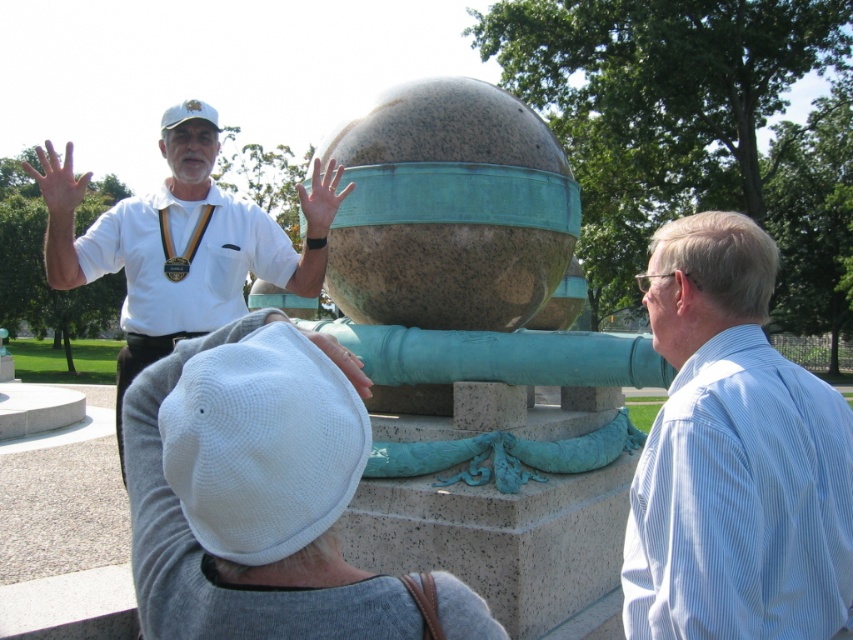
Question: Is granite sphere at center to the right of dry skin at center from the viewer's perspective?

Choices:
 (A) no
 (B) yes

Answer: (B)

Question: Which point appears closest to the camera in this image?

Choices:
 (A) (352, 356)
 (B) (810, 465)
 (C) (544, 125)

Answer: (A)

Question: Which of the following is the closest to the observer?

Choices:
 (A) matte white hand at center
 (B) dry skin at center
 (C) blue striped shirt at right
 (D) white cotton shirt at upper left

Answer: (A)

Question: Can you confirm if blue striped shirt at right is bigger than dry skin at center?

Choices:
 (A) yes
 (B) no

Answer: (B)

Question: Does dry skin at center have a smaller size compared to matte bronze sphere at center?

Choices:
 (A) yes
 (B) no

Answer: (B)

Question: Which object is positioned closest to the white cotton shirt at upper left?

Choices:
 (A) dry skin at center
 (B) granite sphere at center
 (C) matte white hand at center

Answer: (B)